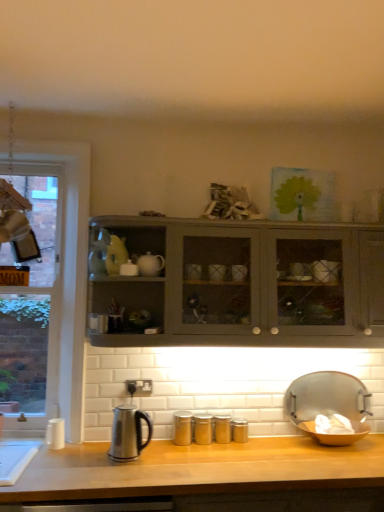
Find the location of `free space in front of stainless steel kettle at lower left`. free space in front of stainless steel kettle at lower left is located at coordinates (134, 474).